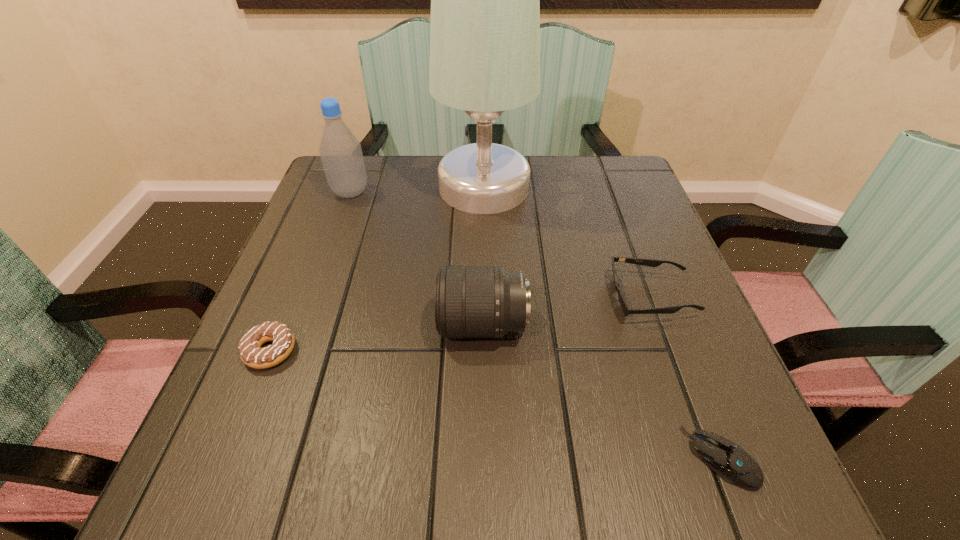
Image resolution: width=960 pixels, height=540 pixels. I want to click on vacant area located 0.090m on the back of the bottle, so click(361, 163).

At what (x,y) coordinates should I click in order to perform the action: click on vacant point located on the surface of the telephoto lens. Please return your answer as a coordinate pair (x, y). Looking at the image, I should click on (294, 325).

Where is `vacant region located on the surface of the telephoto lens`? This screenshot has height=540, width=960. vacant region located on the surface of the telephoto lens is located at coordinates (282, 325).

This screenshot has width=960, height=540. Identify the location of blank space located on the surface of the telephoto lens. (367, 325).

You are a GUI agent. You are given a task and a screenshot of the screen. Output one action in this format:
    pyautogui.click(x=<x>, y=<y>)
    Task: Click on the vacant area situated 0.110m on the front-facing side of the sunglasses
    The width and height of the screenshot is (960, 540).
    Given the screenshot: What is the action you would take?
    pyautogui.click(x=553, y=297)

I want to click on vacant space situated 0.400m on the front-facing side of the sunglasses, so click(x=399, y=297).

The height and width of the screenshot is (540, 960). I want to click on free space located on the front-facing side of the sunglasses, so (425, 297).

Locate an element on the screen. free region located 0.160m on the front of the fifth tallest object is located at coordinates (221, 474).

Where is `free space located 0.280m on the left of the nearest object`? Image resolution: width=960 pixels, height=540 pixels. free space located 0.280m on the left of the nearest object is located at coordinates (489, 458).

Locate an element on the screen. lampshade situated at the far edge is located at coordinates (485, 0).